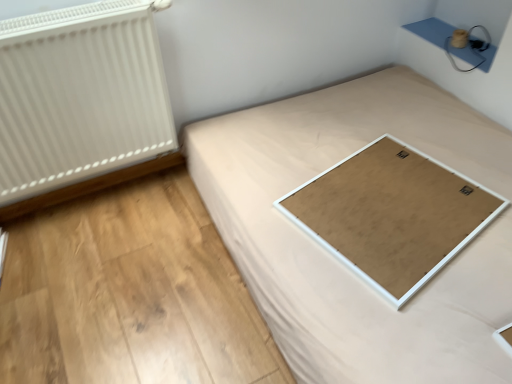
Question: From the image's perspective, would you say natural wood plywood at lower center is shown under white textured radiator at left?

Choices:
 (A) yes
 (B) no

Answer: (A)

Question: From a real-world perspective, is natural wood plywood at lower center on white textured radiator at left?

Choices:
 (A) yes
 (B) no

Answer: (B)

Question: Considering the relative sizes of natural wood plywood at lower center and white textured radiator at left in the image provided, is natural wood plywood at lower center thinner than white textured radiator at left?

Choices:
 (A) no
 (B) yes

Answer: (A)

Question: From a real-world perspective, is natural wood plywood at lower center positioned under white textured radiator at left based on gravity?

Choices:
 (A) yes
 (B) no

Answer: (A)

Question: Can white textured radiator at left be found inside natural wood plywood at lower center?

Choices:
 (A) no
 (B) yes

Answer: (A)

Question: Are natural wood plywood at lower center and white textured radiator at left far apart?

Choices:
 (A) yes
 (B) no

Answer: (B)

Question: From the image's perspective, is white matte board at center above white matte board at center?

Choices:
 (A) no
 (B) yes

Answer: (B)

Question: Is there a large distance between white matte board at center and white matte board at center?

Choices:
 (A) no
 (B) yes

Answer: (A)

Question: Is white matte board at center positioned before white matte board at center?

Choices:
 (A) yes
 (B) no

Answer: (B)

Question: From a real-world perspective, is white matte board at center below white matte board at center?

Choices:
 (A) no
 (B) yes

Answer: (A)

Question: Does white matte board at center come behind white matte board at center?

Choices:
 (A) no
 (B) yes

Answer: (B)

Question: Is white matte board at center touching white matte board at center?

Choices:
 (A) yes
 (B) no

Answer: (B)

Question: Considering the relative sizes of white matte board at center and white textured radiator at left in the image provided, is white matte board at center shorter than white textured radiator at left?

Choices:
 (A) no
 (B) yes

Answer: (B)